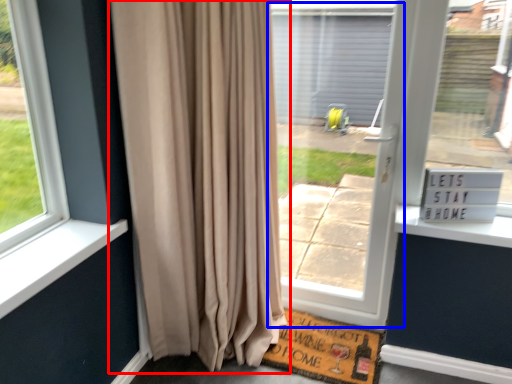
Question: Which object appears farthest to the camera in this image, curtain (highlighted by a red box) or screen door (highlighted by a blue box)?

Choices:
 (A) curtain
 (B) screen door

Answer: (B)